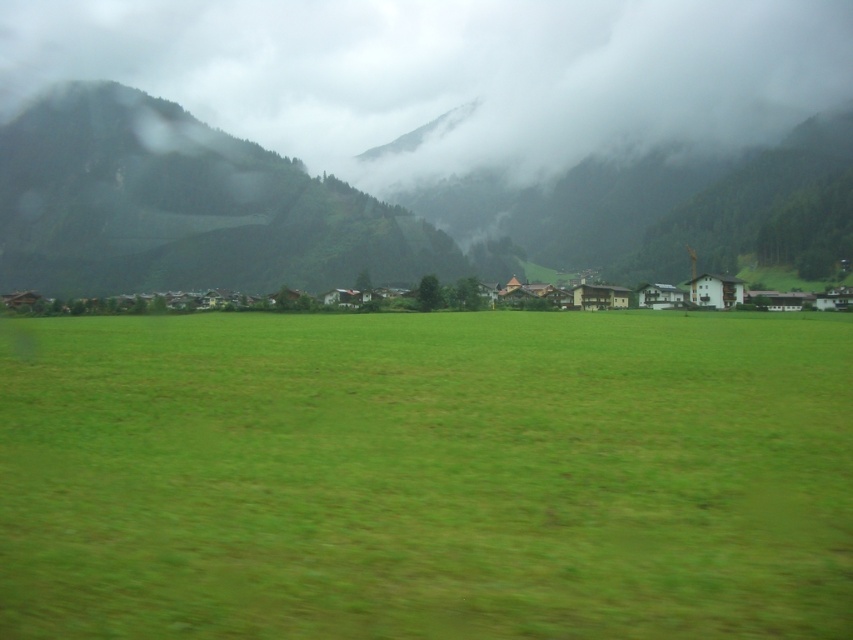
Does green forested mountain at upper left have a smaller size compared to white wooden houses at center?

Actually, green forested mountain at upper left might be larger than white wooden houses at center.

Can you confirm if green forested mountain at upper left is positioned below white wooden houses at center?

Incorrect, green forested mountain at upper left is not positioned below white wooden houses at center.

Describe the element at coordinates (184, 208) in the screenshot. I see `green forested mountain at upper left` at that location.

This screenshot has height=640, width=853. Find the location of `green forested mountain at upper left`. green forested mountain at upper left is located at coordinates (184, 208).

Is the position of green grassy field at center more distant than that of white wooden houses at center?

No.

Is green grassy field at center taller than white wooden houses at center?

Incorrect, green grassy field at center's height is not larger of white wooden houses at center's.

Consider the image. Who is more distant from viewer, (608, 323) or (86, 308)?

Point (86, 308)

Where is `green grassy field at center`? green grassy field at center is located at coordinates (425, 476).

Can you confirm if green grassy field at center is thinner than green forested mountain at upper left?

Correct, green grassy field at center's width is less than green forested mountain at upper left's.

Which is in front, point (717, 564) or point (196, 264)?

Point (717, 564) is in front.

Where is `green grassy field at center`? This screenshot has width=853, height=640. green grassy field at center is located at coordinates (425, 476).